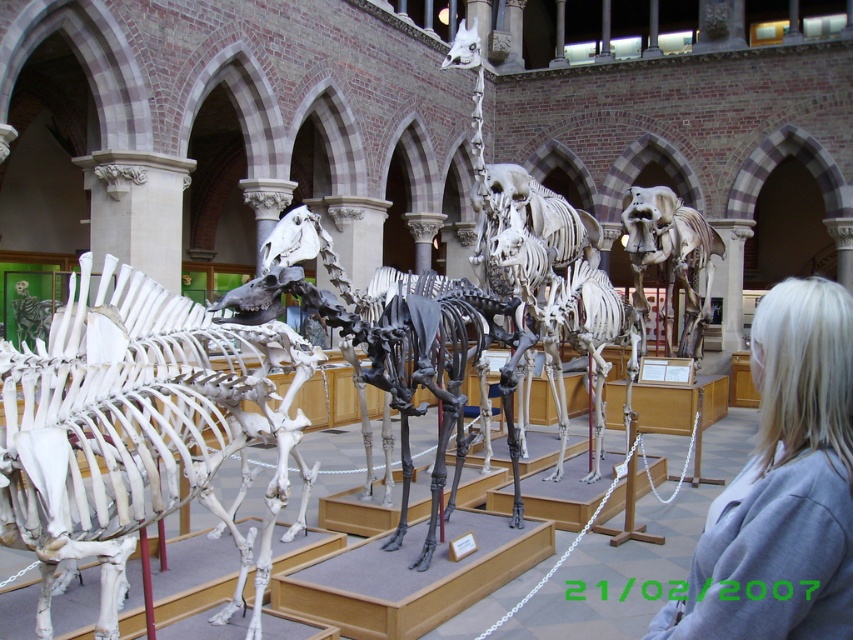
You are a visitor at the museum and notice two items at the center of the display area. One is a blonde hair at center and the other is a white bone elephant at center. Which item is located above the other?

The blonde hair at center is positioned under the white bone elephant at center, so the white bone elephant at center is above the blonde hair at center.

You are a museum visitor who wants to take a photo of both the white bone at center and the white bone elephant at center. Since you want both to be clearly visible in the same frame, which object should you focus on first to ensure proper focus? Please explain your reasoning based on their positions and sizes.

You should focus on the white bone elephant at center first because it is taller than the white bone at center. By focusing on the taller object, you can ensure that the depth of field will include the smaller white bone at center in the background or foreground, making both visible in the same frame.

You are a visitor at the museum and notice two items at the center of the image. One is labeled as blonde hair at center and the other as white bone elephant at center. Which of these two items is physically smaller in size?

The blonde hair at center is smaller in size compared to the white bone elephant at center according to the description.